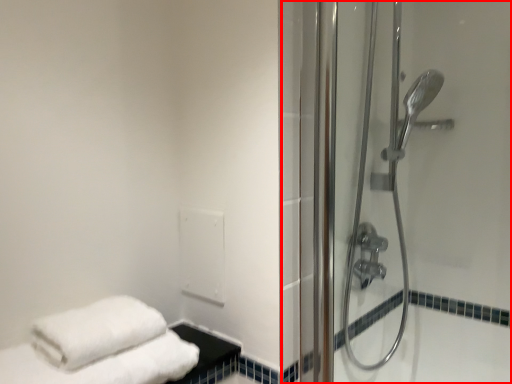
Question: Considering the relative positions of shower door (annotated by the red box) and shower door in the image provided, where is shower door (annotated by the red box) located with respect to the staircase?

Choices:
 (A) right
 (B) left

Answer: (B)